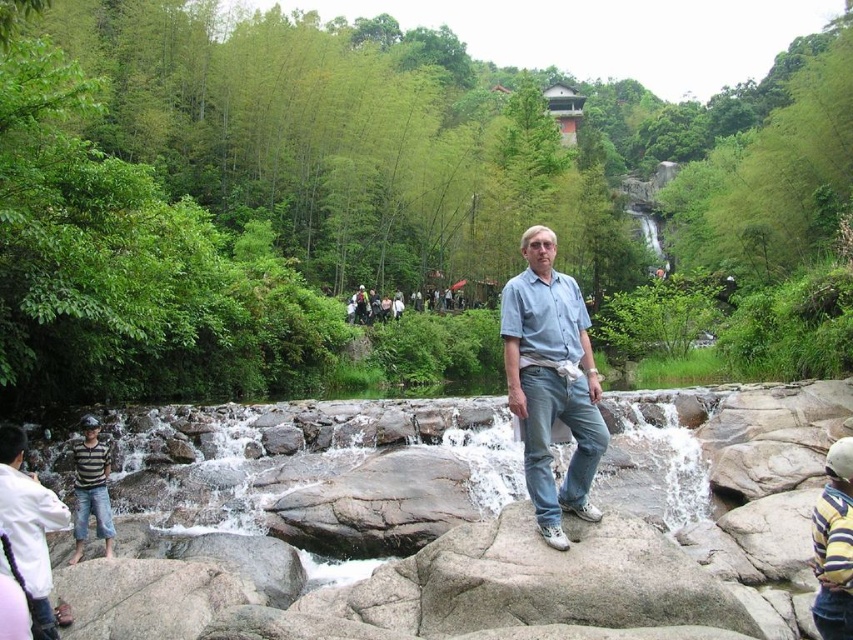
Question: Which object appears farthest from the camera in this image?

Choices:
 (A) white shirt at lower left
 (B) light blue denim jeans at center

Answer: (B)

Question: Does light blue denim jeans at center have a lesser width compared to white shirt at lower left?

Choices:
 (A) no
 (B) yes

Answer: (A)

Question: Does light blue denim jeans at center appear under white shirt at lower left?

Choices:
 (A) yes
 (B) no

Answer: (B)

Question: Is light blue denim jeans at center to the right of white shirt at lower left from the viewer's perspective?

Choices:
 (A) yes
 (B) no

Answer: (A)